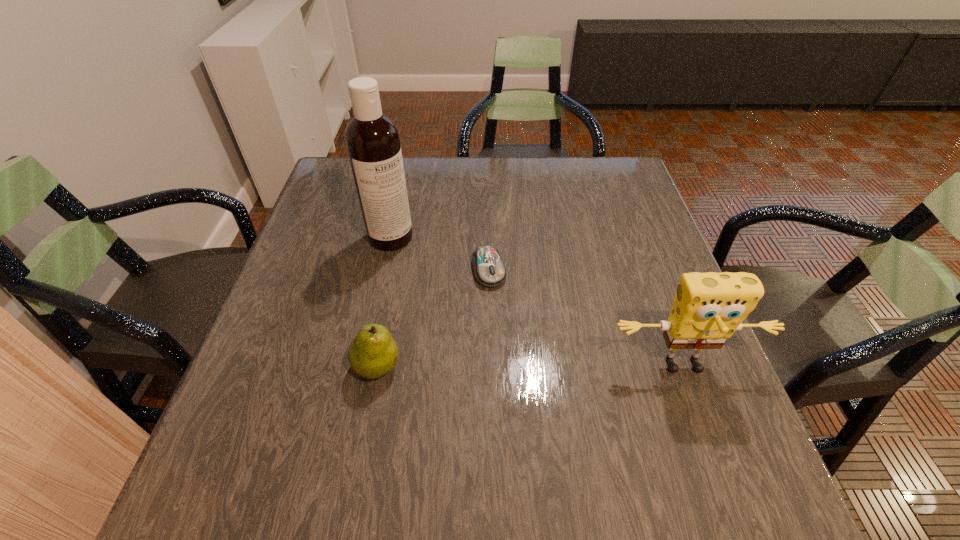
The width and height of the screenshot is (960, 540). What are the coordinates of `the second shortest object` in the screenshot? It's located at (373, 353).

This screenshot has width=960, height=540. In order to click on the rightmost object in this screenshot , I will do `click(709, 307)`.

At what (x,y) coordinates should I click in order to perform the action: click on sponge. Please return your answer as a coordinate pair (x, y). This screenshot has width=960, height=540. Looking at the image, I should click on (709, 307).

You are a GUI agent. You are given a task and a screenshot of the screen. Output one action in this format:
    pyautogui.click(x=<x>, y=<y>)
    Task: Click on the tallest object
    This screenshot has height=540, width=960.
    Given the screenshot: What is the action you would take?
    pyautogui.click(x=372, y=139)

Identify the location of the farthest object. Image resolution: width=960 pixels, height=540 pixels. (372, 139).

You are a GUI agent. You are given a task and a screenshot of the screen. Output one action in this format:
    pyautogui.click(x=<x>, y=<y>)
    Task: Click on the computer mouse
    This screenshot has height=540, width=960.
    Given the screenshot: What is the action you would take?
    pyautogui.click(x=489, y=270)

Image resolution: width=960 pixels, height=540 pixels. What are the coordinates of `the shortest object` in the screenshot? It's located at (489, 270).

The image size is (960, 540). Identify the location of free space located 0.120m on the left of the pear. (293, 366).

Find the location of a particular element. The image size is (960, 540). vacant space located on the face of the third shortest object is located at coordinates (704, 422).

The height and width of the screenshot is (540, 960). What are the coordinates of `free location located 0.150m on the label side of the tallest object` in the screenshot? It's located at (441, 281).